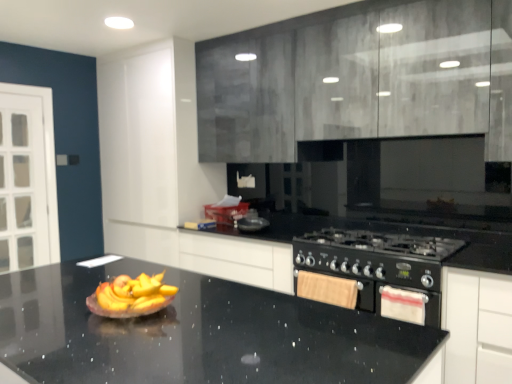
Question: From a real-world perspective, is white fabric oven at lower right beneath matte gray cabinets at upper center?

Choices:
 (A) no
 (B) yes

Answer: (B)

Question: From a real-world perspective, is white fabric oven at lower right positioned over matte gray cabinets at upper center based on gravity?

Choices:
 (A) yes
 (B) no

Answer: (B)

Question: From the image's perspective, would you say white fabric oven at lower right is shown under matte gray cabinets at upper center?

Choices:
 (A) yes
 (B) no

Answer: (A)

Question: Is white fabric oven at lower right behind matte gray cabinets at upper center?

Choices:
 (A) yes
 (B) no

Answer: (A)

Question: Would you say white fabric oven at lower right is a long distance from matte gray cabinets at upper center?

Choices:
 (A) no
 (B) yes

Answer: (B)

Question: Considering the relative sizes of white fabric oven at lower right and matte gray cabinets at upper center in the image provided, is white fabric oven at lower right smaller than matte gray cabinets at upper center?

Choices:
 (A) no
 (B) yes

Answer: (B)

Question: Is black matte gas stove at lower right with black granite countertop at center?

Choices:
 (A) no
 (B) yes

Answer: (A)

Question: Does black matte gas stove at lower right have a lesser height compared to black granite countertop at center?

Choices:
 (A) yes
 (B) no

Answer: (A)

Question: Can you confirm if black matte gas stove at lower right is positioned to the right of black granite countertop at center?

Choices:
 (A) yes
 (B) no

Answer: (A)

Question: Is black matte gas stove at lower right outside black granite countertop at center?

Choices:
 (A) yes
 (B) no

Answer: (A)

Question: Considering the relative sizes of black matte gas stove at lower right and black granite countertop at center in the image provided, is black matte gas stove at lower right taller than black granite countertop at center?

Choices:
 (A) yes
 (B) no

Answer: (B)

Question: Does black matte gas stove at lower right appear on the left side of black granite countertop at center?

Choices:
 (A) yes
 (B) no

Answer: (B)

Question: Does matte gray cabinets at upper center come in front of black matte gas stove at lower right?

Choices:
 (A) no
 (B) yes

Answer: (B)